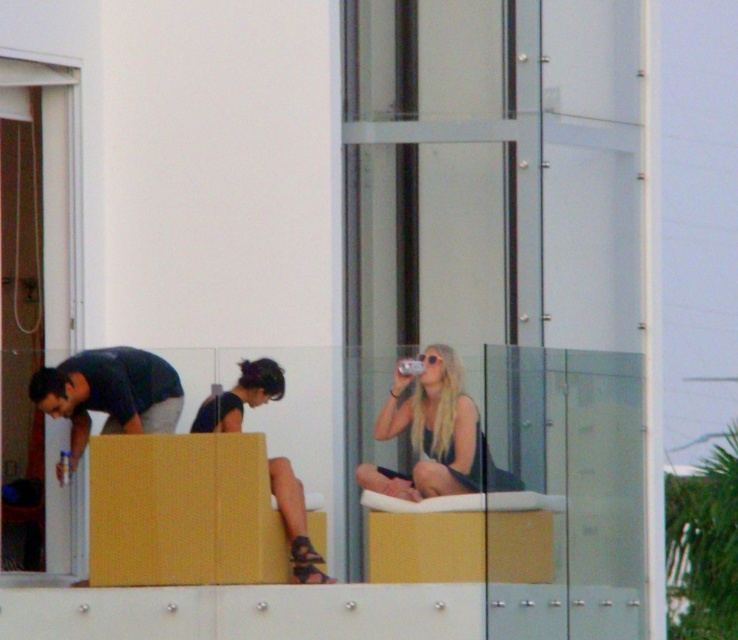
Question: Can you confirm if blonde hair at center is smaller than matte black sandals at center?

Choices:
 (A) yes
 (B) no

Answer: (B)

Question: Does blonde hair at center have a lesser width compared to matte black sandals at center?

Choices:
 (A) yes
 (B) no

Answer: (B)

Question: Estimate the real-world distances between objects in this image. Which object is closer to the matte black sandals at center?

Choices:
 (A) matte black shirt at left
 (B) blonde hair at center

Answer: (B)

Question: Which point is closer to the camera?

Choices:
 (A) matte black sandals at center
 (B) blonde hair at center
 (C) matte black shirt at left

Answer: (B)

Question: Does matte black shirt at left appear on the left side of matte black sandals at center?

Choices:
 (A) yes
 (B) no

Answer: (A)

Question: Which object appears farthest from the camera in this image?

Choices:
 (A) matte black shirt at left
 (B) blonde hair at center
 (C) matte black sandals at center

Answer: (A)